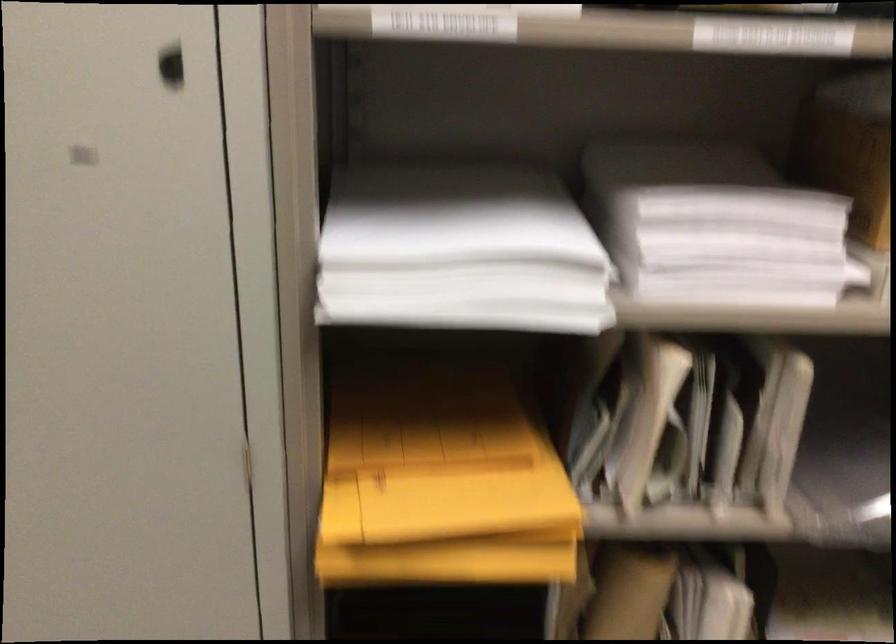
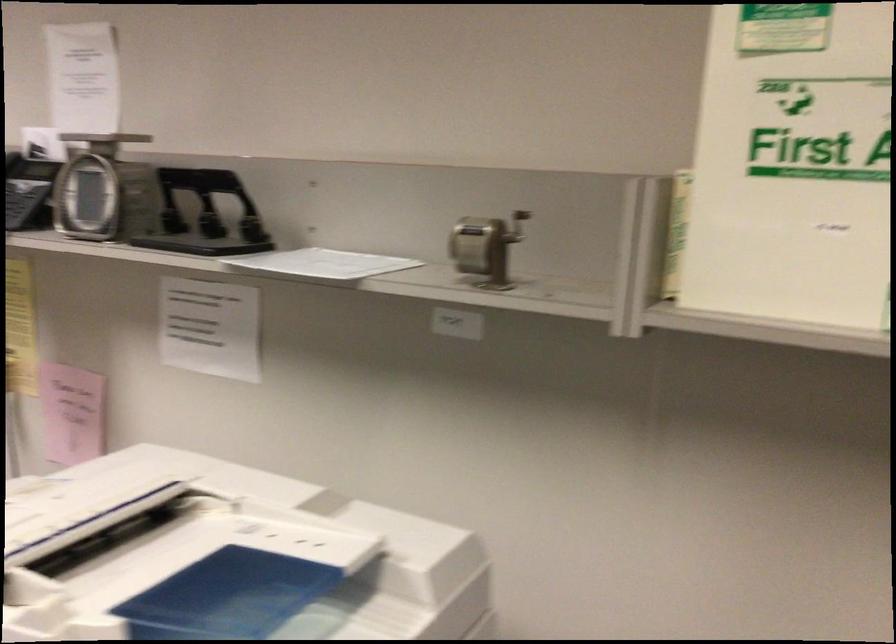
Based on the continuous images, in which direction is the camera rotating?

The camera's rotation is toward right-down.